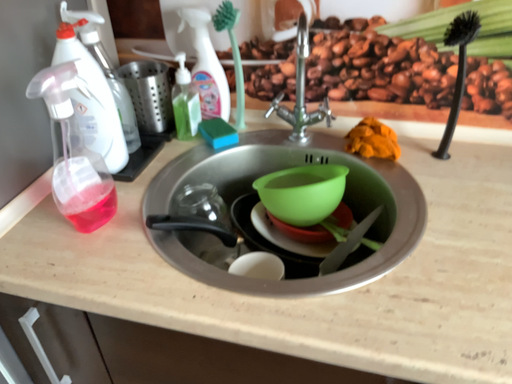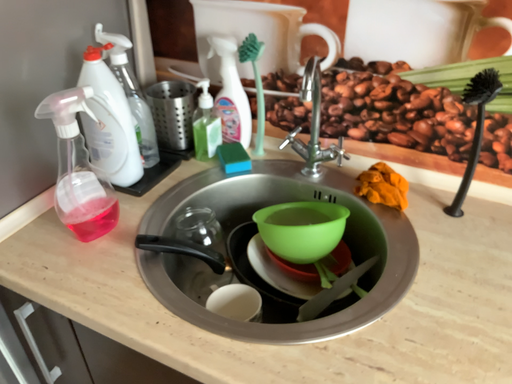
Question: How did the camera likely rotate when shooting the video?

Choices:
 (A) rotated left
 (B) rotated right

Answer: (A)